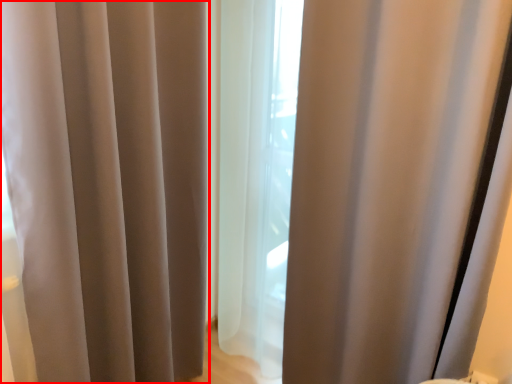
Question: From the image's perspective, considering the relative positions of curtain (annotated by the red box) and curtain in the image provided, where is curtain (annotated by the red box) located with respect to the staircase?

Choices:
 (A) above
 (B) below

Answer: (B)